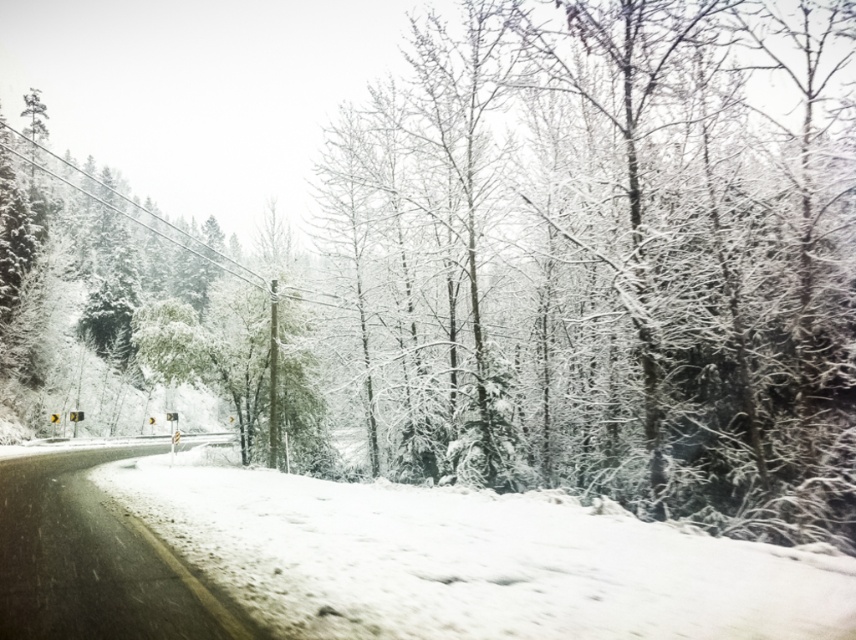
Question: Which point appears closest to the camera in this image?

Choices:
 (A) (657, 525)
 (B) (100, 556)

Answer: (B)

Question: Which point is farther to the camera?

Choices:
 (A) white fluffy snow at center
 (B) snowy asphalt road at lower left

Answer: (B)

Question: Can you confirm if white fluffy snow at center is positioned above snowy asphalt road at lower left?

Choices:
 (A) yes
 (B) no

Answer: (A)

Question: Does white fluffy snow at center have a greater width compared to snowy asphalt road at lower left?

Choices:
 (A) no
 (B) yes

Answer: (B)

Question: Is white fluffy snow at center bigger than snowy asphalt road at lower left?

Choices:
 (A) yes
 (B) no

Answer: (B)

Question: Which object is closer to the camera taking this photo?

Choices:
 (A) snowy asphalt road at lower left
 (B) white fluffy snow at center

Answer: (B)